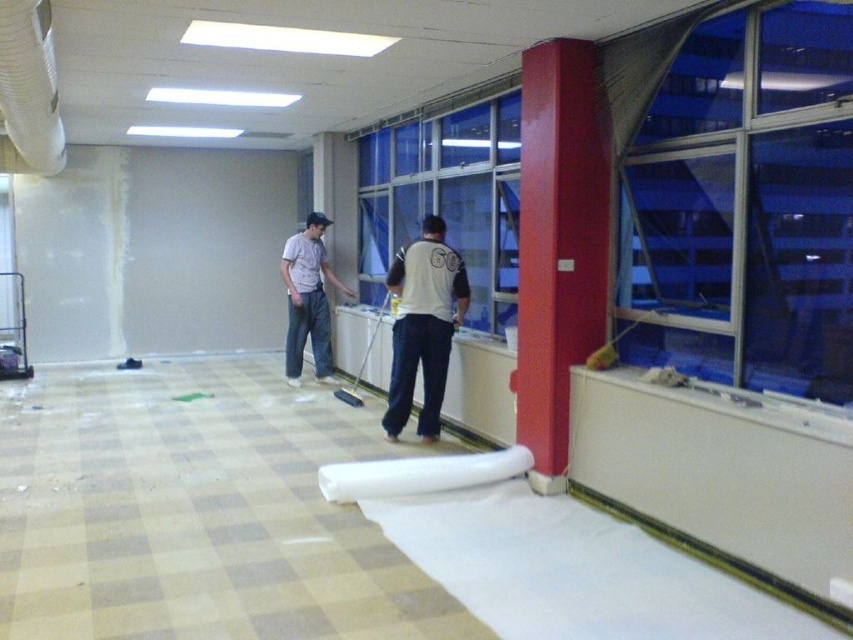
Question: Among these objects, which one is farthest from the camera?

Choices:
 (A) white matte shirt at center
 (B) transparent glass window at upper right

Answer: (A)

Question: Can you confirm if transparent glass window at upper right is thinner than white matte shirt at center?

Choices:
 (A) no
 (B) yes

Answer: (A)

Question: Is transparent glass window at upper right positioned in front of blue glass window at center?

Choices:
 (A) yes
 (B) no

Answer: (A)

Question: Can you confirm if transparent glass window at upper right is smaller than blue glass window at center?

Choices:
 (A) yes
 (B) no

Answer: (A)

Question: Which of the following is the farthest from the observer?

Choices:
 (A) light gray cotton shirt at center
 (B) transparent glass window at upper right

Answer: (A)

Question: Estimate the real-world distances between objects in this image. Which object is farther from the light gray cotton shirt at center?

Choices:
 (A) blue glass window at center
 (B) smooth glossy red pillar at right

Answer: (B)